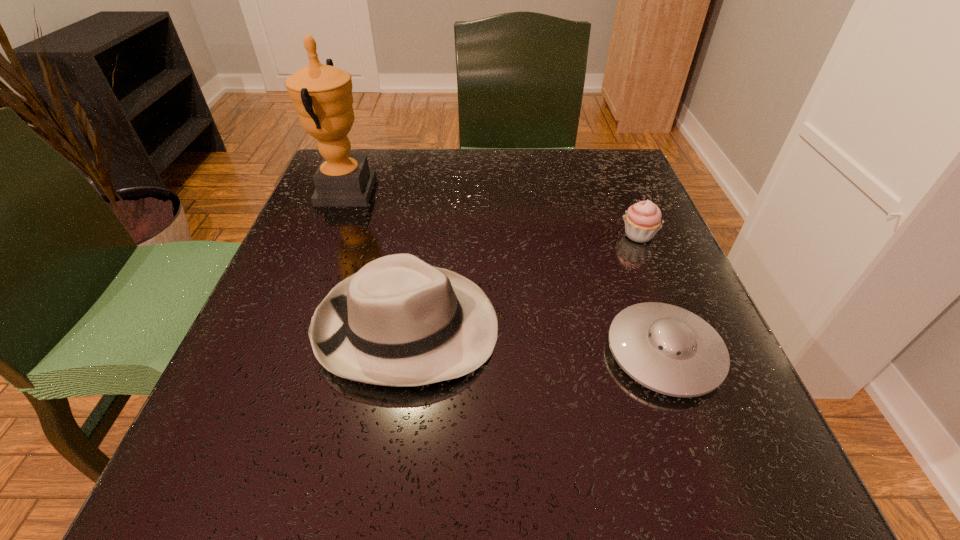
Where is `vacant space that satisfies the following two spatial constraints: 1. at the front of the award with handles; 2. on the left side of the shortest object`? This screenshot has height=540, width=960. vacant space that satisfies the following two spatial constraints: 1. at the front of the award with handles; 2. on the left side of the shortest object is located at coordinates (281, 353).